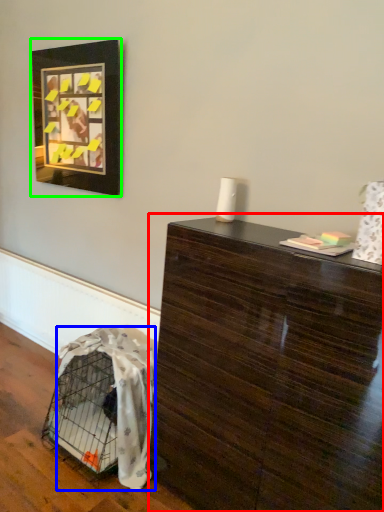
Question: Which is farther away from table (highlighted by a red box)? blanket (highlighted by a blue box) or picture frame (highlighted by a green box)?

Choices:
 (A) blanket
 (B) picture frame

Answer: (B)